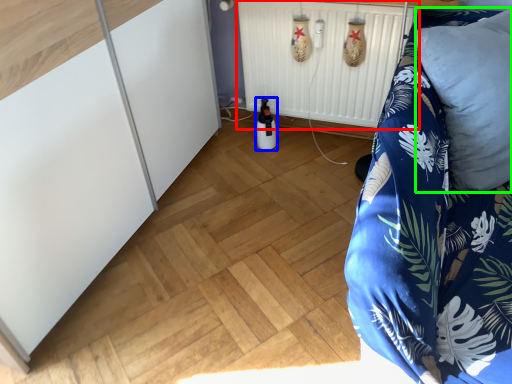
Question: Estimate the real-world distances between objects in this image. Which object is closer to radiator (highlighted by a red box), bottle (highlighted by a blue box) or pillow (highlighted by a green box)?

Choices:
 (A) bottle
 (B) pillow

Answer: (A)